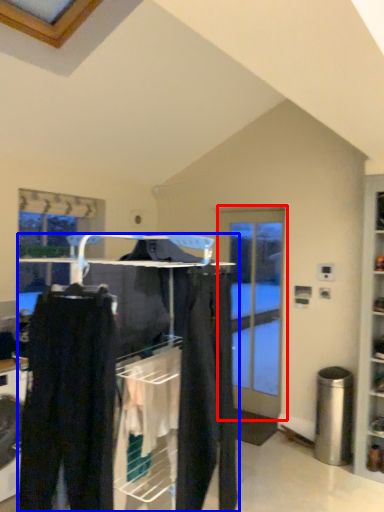
Question: Among these objects, which one is nearest to the camera, door (highlighted by a red box) or closet (highlighted by a blue box)?

Choices:
 (A) door
 (B) closet

Answer: (B)